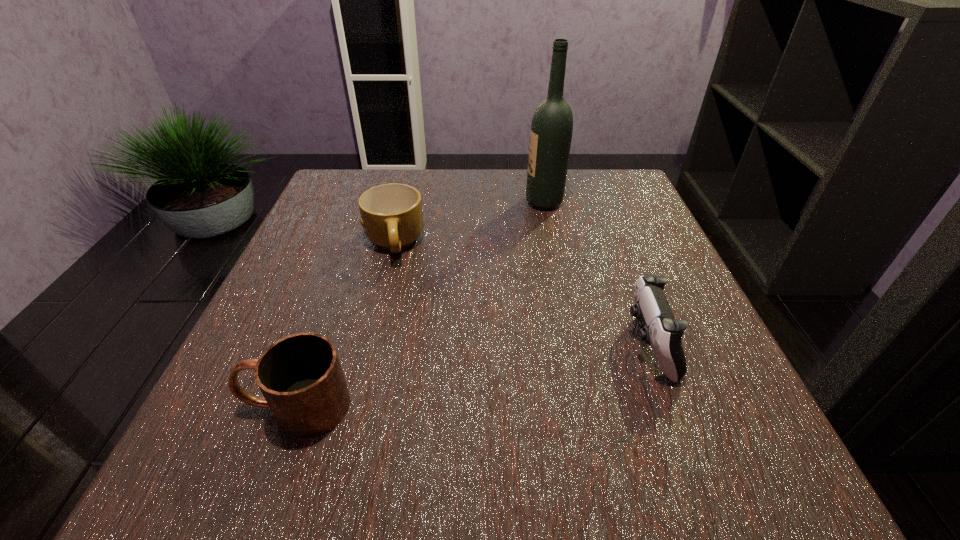
Find the location of `vacant space at the far left corner`. vacant space at the far left corner is located at coordinates (319, 201).

Image resolution: width=960 pixels, height=540 pixels. I want to click on free spot between the third nearest object and the nearer mug, so click(x=345, y=325).

The image size is (960, 540). I want to click on free spot between the second farthest object and the nearer mug, so click(x=345, y=325).

This screenshot has height=540, width=960. I want to click on vacant point located between the second farthest object and the nearer mug, so click(x=345, y=325).

Locate an element on the screen. The height and width of the screenshot is (540, 960). free space between the farther mug and the farthest object is located at coordinates [x=469, y=222].

The image size is (960, 540). In order to click on vacant point located between the control and the wine bottle in this screenshot , I will do `click(596, 273)`.

This screenshot has height=540, width=960. Find the location of `free space between the nearer mug and the third nearest object`. free space between the nearer mug and the third nearest object is located at coordinates (x=345, y=325).

Where is `free point between the nearer mug and the control`? free point between the nearer mug and the control is located at coordinates (472, 375).

Locate an element on the screen. The width and height of the screenshot is (960, 540). vacant space in between the third object from left to right and the nearer mug is located at coordinates (420, 304).

Identify the location of empty space between the tallest object and the second farthest object. The height and width of the screenshot is (540, 960). (469, 222).